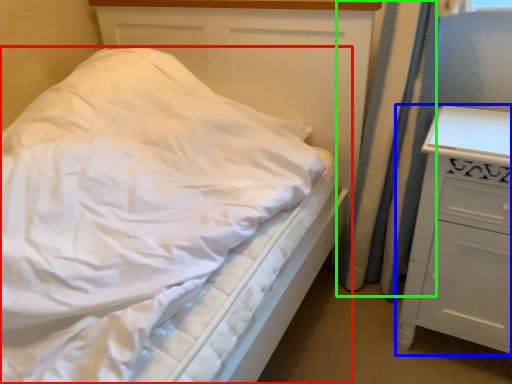
Question: Which object is the farthest from bed (highlighted by a red box)? Choose among these: chest of drawers (highlighted by a blue box) or curtain (highlighted by a green box).

Choices:
 (A) chest of drawers
 (B) curtain

Answer: (B)